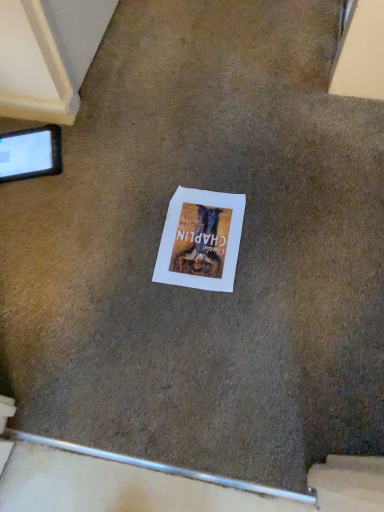
I want to click on empty space that is ontop of white paper at center (from a real-world perspective), so click(x=198, y=234).